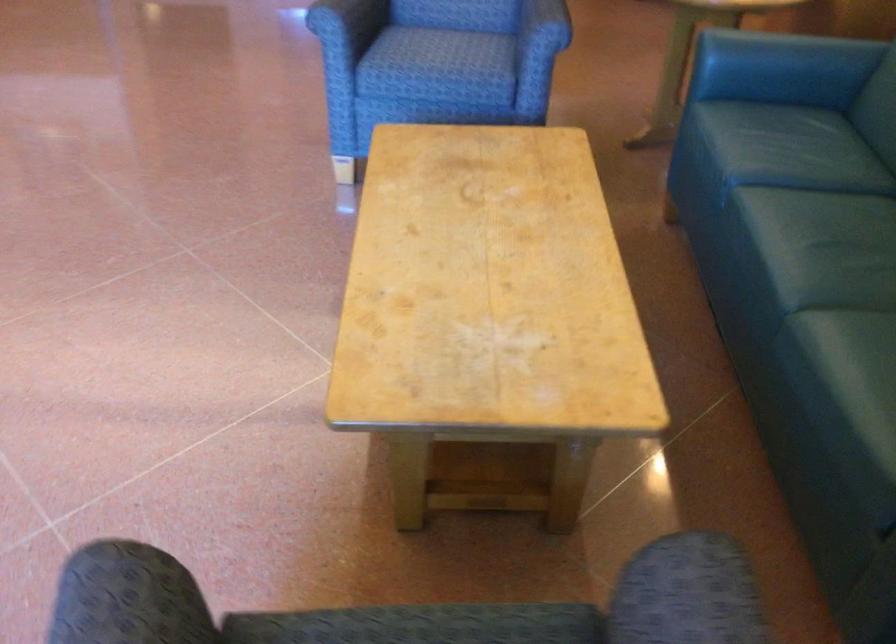
Where is `green sofa sitting surface`? green sofa sitting surface is located at coordinates (776, 147).